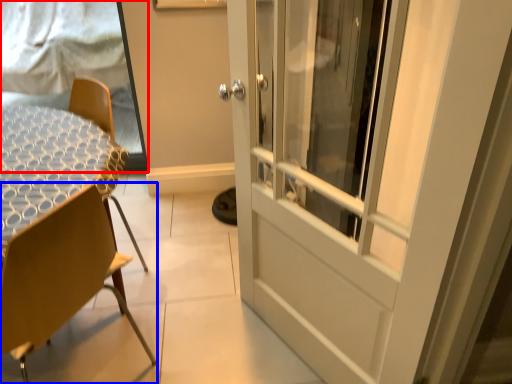
Question: Which point is closer to the camera, window screen (highlighted by a red box) or chair (highlighted by a blue box)?

Choices:
 (A) window screen
 (B) chair

Answer: (B)